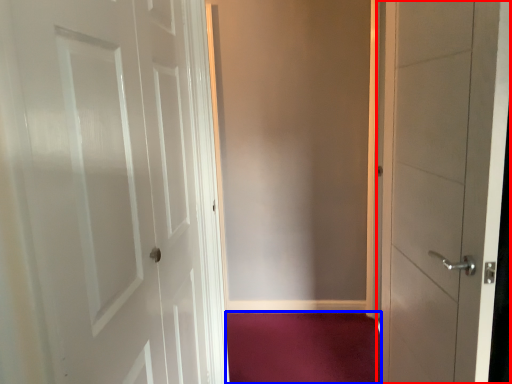
Question: Which object appears farthest to the camera in this image, door (highlighted by a red box) or plain (highlighted by a blue box)?

Choices:
 (A) door
 (B) plain

Answer: (B)